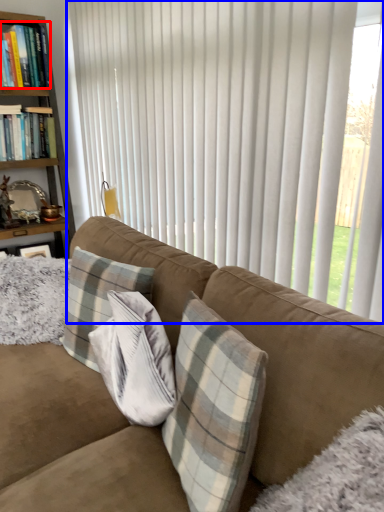
Question: Which object is further to the camera taking this photo, book (highlighted by a red box) or curtain (highlighted by a blue box)?

Choices:
 (A) book
 (B) curtain

Answer: (A)